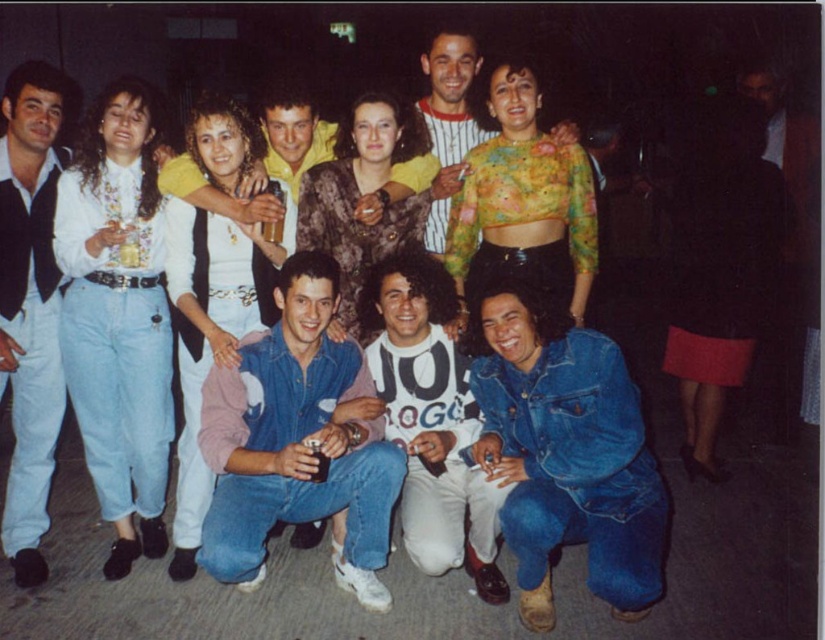
Question: Estimate the real-world distances between objects in this image. Which object is farther from the shiny gold chain at center?

Choices:
 (A) matte black vest at left
 (B) denim jacket at lower right

Answer: (B)

Question: Can you confirm if matte black vest at left is wider than fur coat at center?

Choices:
 (A) no
 (B) yes

Answer: (A)

Question: Which point is farther to the camera?

Choices:
 (A) denim jacket at center
 (B) floral sheer top at center
 (C) matte black skirt at right
 (D) fur coat at center

Answer: (C)

Question: In this image, where is denim jacket at lower right located relative to floral sheer top at center?

Choices:
 (A) left
 (B) right

Answer: (B)

Question: Which of the following is the farthest from the observer?

Choices:
 (A) (667, 196)
 (B) (290, 80)
 (C) (345, 417)

Answer: (B)

Question: Can you confirm if denim jacket at center is smaller than white matte shirt at left?

Choices:
 (A) yes
 (B) no

Answer: (B)